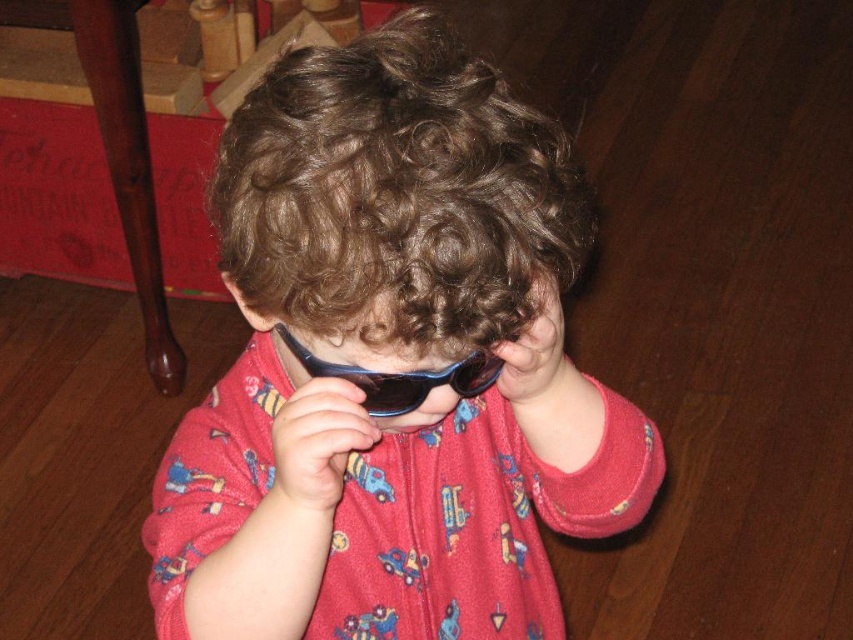
Is brown curly hair at center below blue plastic sunglasses at center?

Incorrect, brown curly hair at center is not positioned below blue plastic sunglasses at center.

Does brown curly hair at center have a greater width compared to blue plastic sunglasses at center?

Yes.

Is point (263, 260) less distant than point (309, 362)?

Yes, point (263, 260) is in front of point (309, 362).

At what (x,y) coordinates should I click in order to perform the action: click on brown curly hair at center. Please return your answer as a coordinate pair (x, y). This screenshot has height=640, width=853. Looking at the image, I should click on (396, 193).

I want to click on matte plastic sunglasses at center, so click(392, 364).

Does point (477, 88) lie behind point (370, 406)?

No, it is not.

Where is `matte plastic sunglasses at center`? This screenshot has height=640, width=853. matte plastic sunglasses at center is located at coordinates (392, 364).

Can you confirm if matte plastic sunglasses at center is positioned above brown curly hair at center?

No.

Does matte plastic sunglasses at center have a greater height compared to brown curly hair at center?

Correct, matte plastic sunglasses at center is much taller as brown curly hair at center.

Identify the location of matte plastic sunglasses at center. (392, 364).